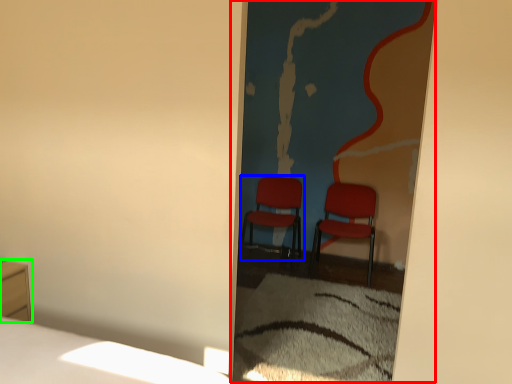
Question: Considering the real-world distances, which object is farthest from screen door (highlighted by a red box)? chair (highlighted by a blue box) or furniture (highlighted by a green box)?

Choices:
 (A) chair
 (B) furniture

Answer: (B)